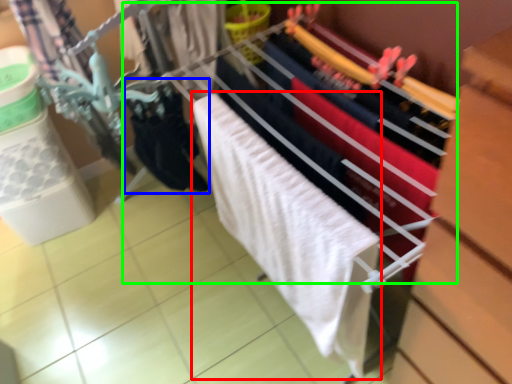
Question: Which is nearer to the bath towel (highlighted by a red box)? clothing (highlighted by a blue box) or closet (highlighted by a green box).

Choices:
 (A) clothing
 (B) closet

Answer: (B)